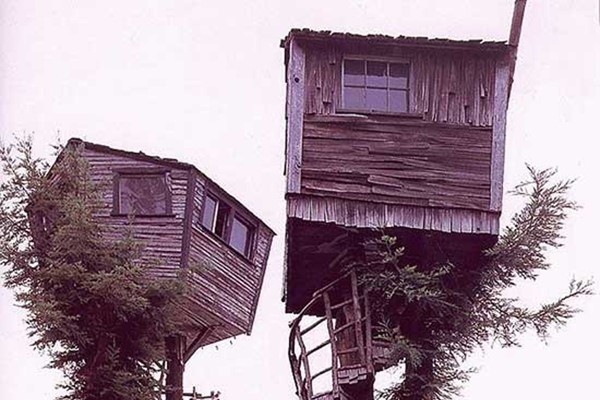
Where is `long window to let air in`? long window to let air in is located at coordinates (208, 212).